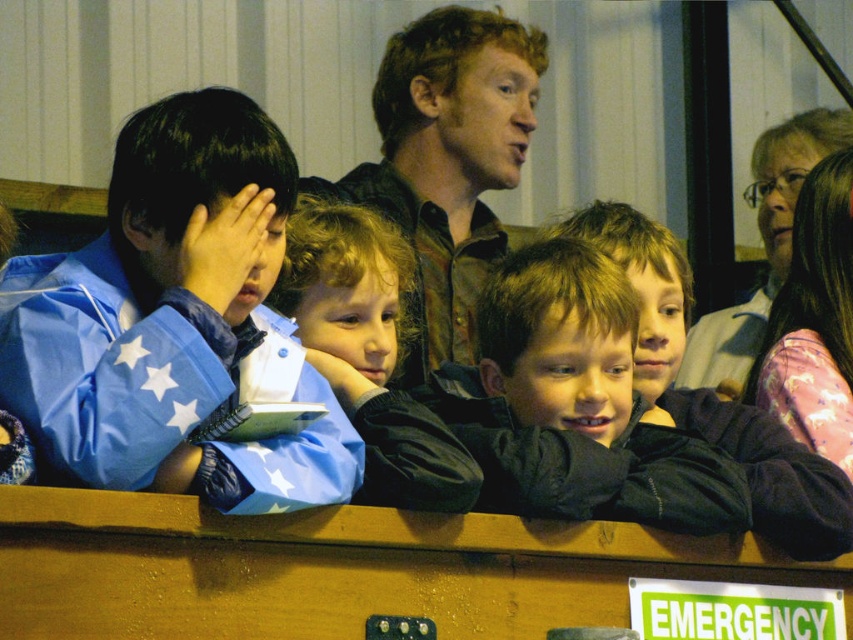
The width and height of the screenshot is (853, 640). What do you see at coordinates (173, 321) in the screenshot?
I see `blue matte jacket at left` at bounding box center [173, 321].

Is point (120, 369) more distant than point (780, 230)?

No.

Identify the location of blue matte jacket at left. The image size is (853, 640). (173, 321).

Does blue matte jacket at left have a greater height compared to dark brown fabric jacket at center?

Yes.

Who is shorter, blue matte jacket at left or dark brown fabric jacket at center?

With less height is dark brown fabric jacket at center.

At what (x,y) coordinates should I click in order to perform the action: click on blue matte jacket at left. Please return your answer as a coordinate pair (x, y). This screenshot has height=640, width=853. Looking at the image, I should click on (173, 321).

Does dark brown velvety jacket at center appear on the left side of pink satin dress at right?

Correct, you'll find dark brown velvety jacket at center to the left of pink satin dress at right.

Which is more to the left, dark brown velvety jacket at center or pink satin dress at right?

From the viewer's perspective, dark brown velvety jacket at center appears more on the left side.

Is point (669, 349) less distant than point (775, 145)?

That is True.

Where is `dark brown velvety jacket at center`? dark brown velvety jacket at center is located at coordinates (715, 392).